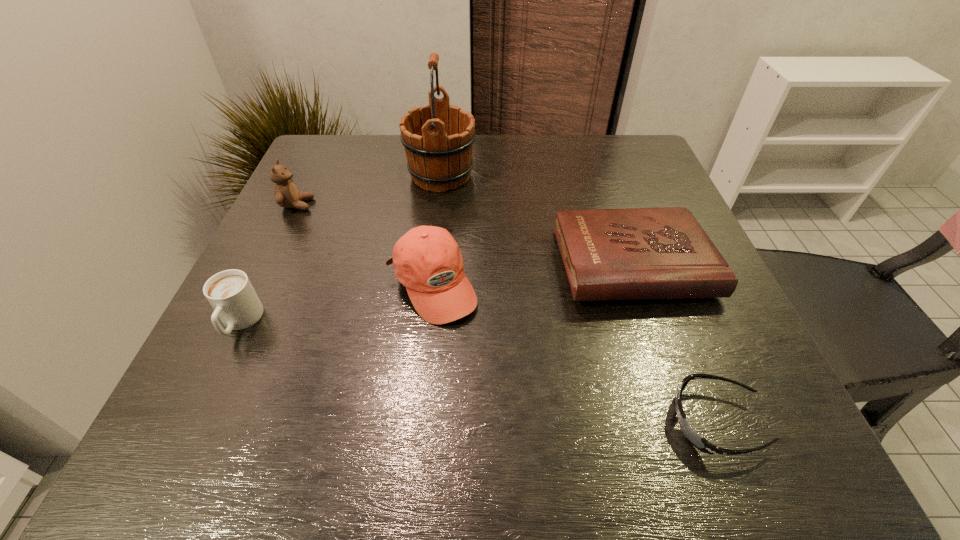
This screenshot has height=540, width=960. In order to click on free space between the tallest object and the teddy bear in this screenshot , I will do `click(369, 190)`.

The image size is (960, 540). Identify the location of free space between the nearest object and the hardback book. (674, 342).

At what (x,y) coordinates should I click in order to perform the action: click on blank region between the wine bucket and the teddy bear. Please return your answer as a coordinate pair (x, y). Looking at the image, I should click on (369, 190).

Locate an element on the screen. vacant space that's between the fourth tallest object and the sunglasses is located at coordinates (478, 372).

Find the location of `unoccupied position between the shortest object and the cappuccino`. unoccupied position between the shortest object and the cappuccino is located at coordinates (478, 372).

Where is `vacant space that's between the baseball cap and the cappuccino`? This screenshot has width=960, height=540. vacant space that's between the baseball cap and the cappuccino is located at coordinates (336, 304).

Find the location of a particular element. vacant point located between the teddy bear and the baseball cap is located at coordinates (365, 245).

Identify the location of vacant area that lies between the cappuccino and the wine bucket. (341, 249).

This screenshot has width=960, height=540. Find the location of `the fifth closest object to the teddy bear`. the fifth closest object to the teddy bear is located at coordinates (692, 436).

Locate which object ranks fifth in proximity to the hardback book. Please provide its 2D coordinates. Your answer should be formatted as a tuple, i.e. [(x, y)], where the tuple contains the x and y coordinates of a point satisfying the conditions above.

[(231, 294)]